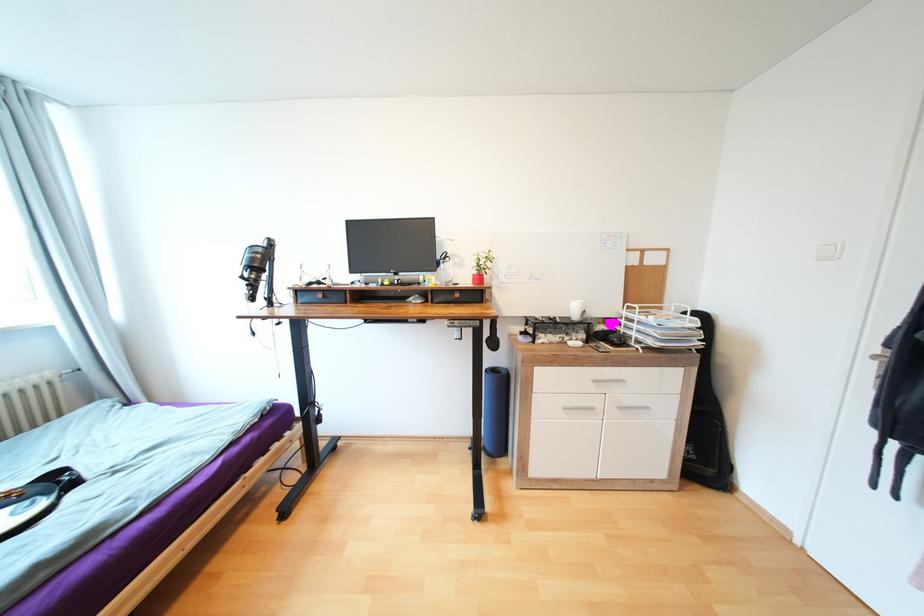
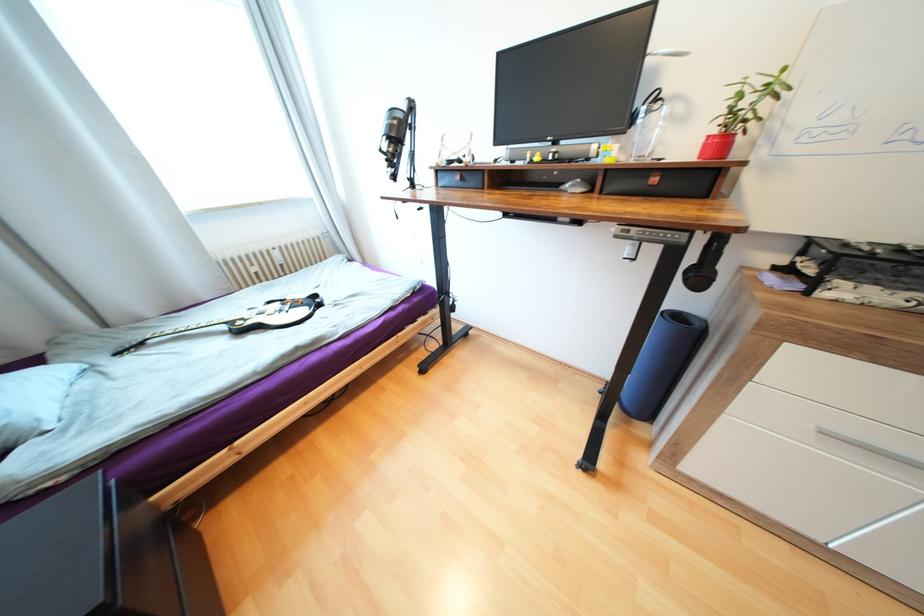
Locate, in the second image, the point that corresponds to (x=388, y=285) in the first image.

(537, 161)